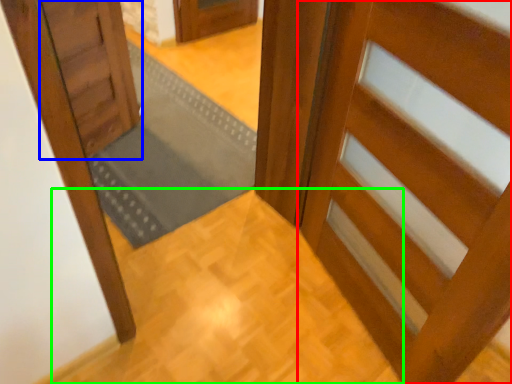
Question: Which object is the farthest from door (highlighted by a red box)? Choose among these: door (highlighted by a blue box) or path (highlighted by a green box).

Choices:
 (A) door
 (B) path

Answer: (A)